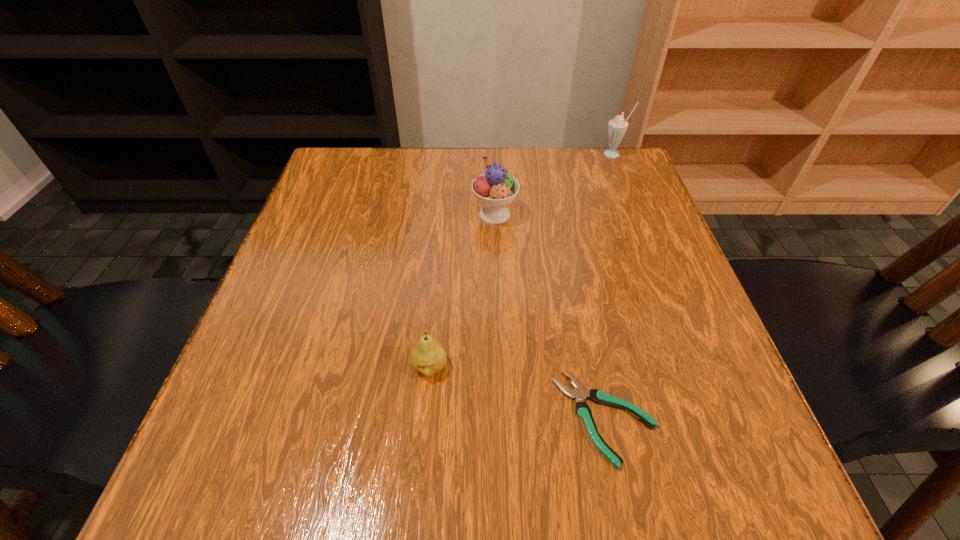
In the image, there is a desktop. Identify the location of free region at the near edge. (353, 456).

At what (x,y) coordinates should I click in order to perform the action: click on free region at the left edge of the desktop. Please return your answer as a coordinate pair (x, y). Looking at the image, I should click on (327, 385).

At what (x,y) coordinates should I click in order to perform the action: click on free region at the right edge of the desktop. Please return your answer as a coordinate pair (x, y). The height and width of the screenshot is (540, 960). Looking at the image, I should click on point(681,379).

The height and width of the screenshot is (540, 960). In order to click on vacant space at the far left corner of the desktop in this screenshot , I will do `click(336, 158)`.

Image resolution: width=960 pixels, height=540 pixels. In order to click on free space between the farthest object and the second object from right to left in this screenshot , I will do [x=611, y=286].

Find the location of a particular element. The image size is (960, 540). vacant space that's between the shortest object and the leftmost object is located at coordinates (x=517, y=392).

You are a GUI agent. You are given a task and a screenshot of the screen. Output one action in this format:
    pyautogui.click(x=<x>, y=<y>)
    Task: Click on the free area in between the leftmost object and the rightmost object
    This screenshot has height=540, width=960.
    Given the screenshot: What is the action you would take?
    pyautogui.click(x=522, y=261)

In order to click on vacant point located between the pear and the third object from right to left in this screenshot , I will do `click(463, 291)`.

Identify the location of free spot between the third nearest object and the pear. This screenshot has height=540, width=960. (463, 291).

Locate an element on the screen. The width and height of the screenshot is (960, 540). free point between the pear and the icecream is located at coordinates (463, 291).